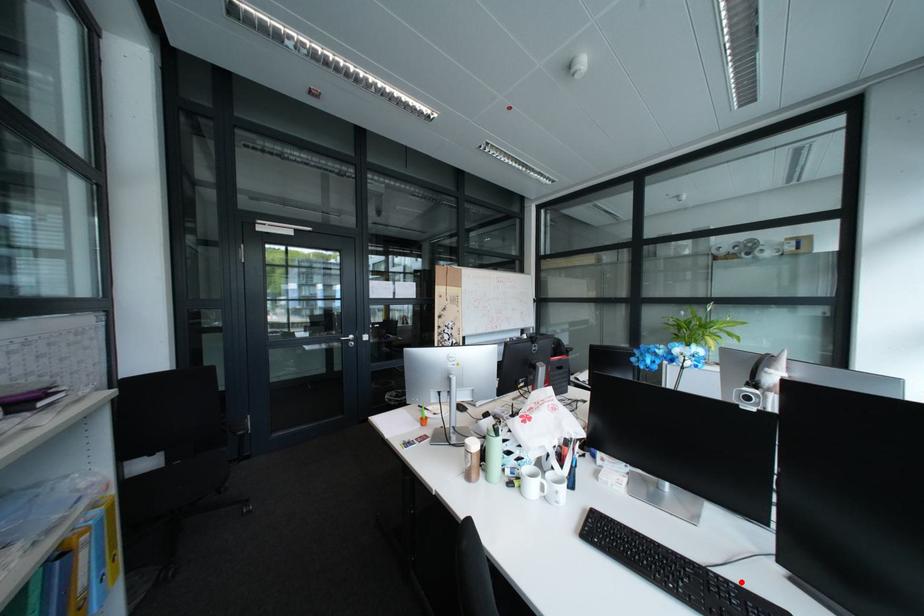
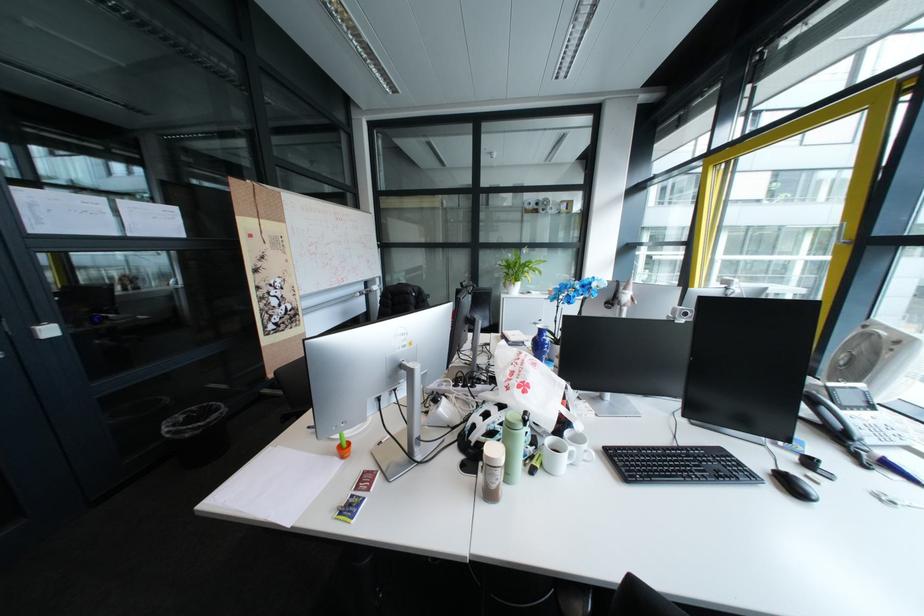
The point at the highlighted location is marked in the first image. Where is the corresponding point in the second image?

(710, 448)